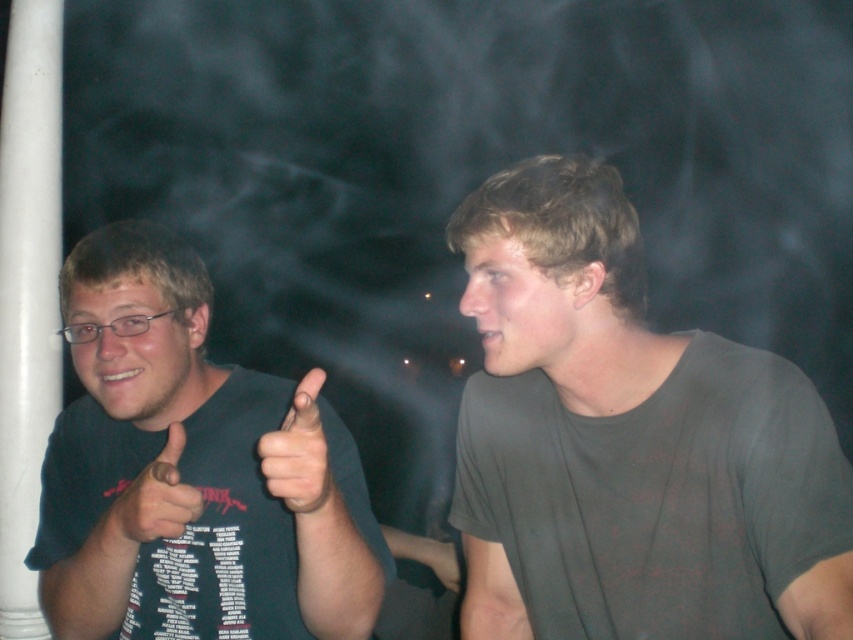
Question: Which point is closer to the camera taking this photo?

Choices:
 (A) (263, 442)
 (B) (183, 513)

Answer: (A)

Question: Is gray matte t-shirt at center closer to camera compared to skinny white hand at center?

Choices:
 (A) yes
 (B) no

Answer: (B)

Question: Can you confirm if gray matte t-shirt at center is positioned above matte black thumb at left?

Choices:
 (A) yes
 (B) no

Answer: (A)

Question: Which object appears closest to the camera in this image?

Choices:
 (A) gray matte t-shirt at center
 (B) dark blue t-shirt at left

Answer: (B)

Question: Which object is the closest to the matte black thumb at left?

Choices:
 (A) dark blue t-shirt at left
 (B) skinny white hand at center

Answer: (B)

Question: Does dark blue t-shirt at left appear on the left side of skinny white hand at center?

Choices:
 (A) no
 (B) yes

Answer: (B)